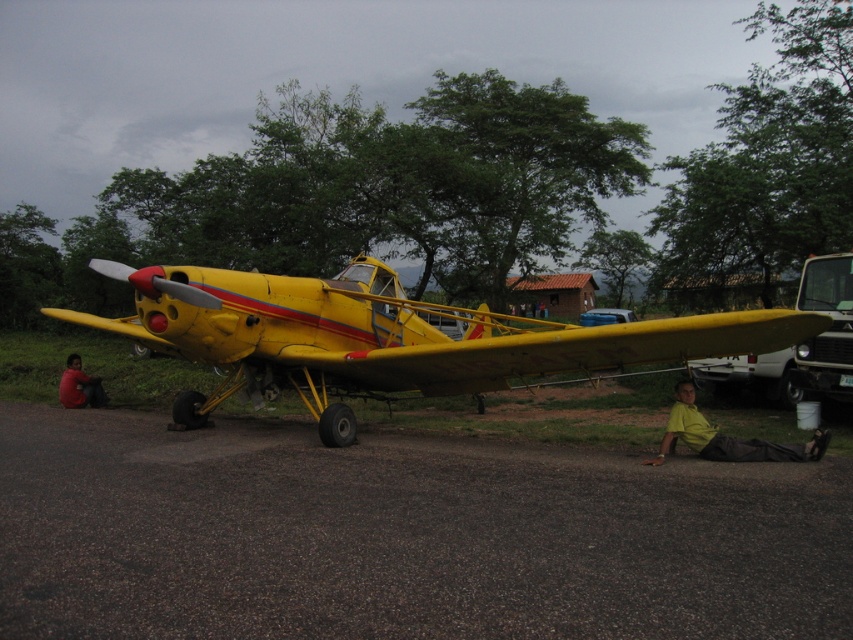
Is point (683, 380) behind point (100, 388)?

Yes, it is.

Does point (819, 433) come in front of point (74, 372)?

Yes, point (819, 433) is closer to viewer.

You are a GUI agent. You are given a task and a screenshot of the screen. Output one action in this format:
    pyautogui.click(x=<x>, y=<y>)
    Task: Click on the yellow cotton shirt at lower right
    Image resolution: width=853 pixels, height=640 pixels.
    Given the screenshot: What is the action you would take?
    pyautogui.click(x=726, y=436)

Is yellow matte airplane at center wider than dark red shirt at lower left?

Correct, the width of yellow matte airplane at center exceeds that of dark red shirt at lower left.

Is yellow matte airplane at center shorter than dark red shirt at lower left?

In fact, yellow matte airplane at center may be taller than dark red shirt at lower left.

Is point (410, 348) closer to camera compared to point (62, 392)?

That is True.

Locate an element on the screen. yellow matte airplane at center is located at coordinates (387, 337).

Is yellow matte airplane at center below yellow cotton shirt at lower right?

Incorrect, yellow matte airplane at center is not positioned below yellow cotton shirt at lower right.

Who is lower down, yellow matte airplane at center or yellow cotton shirt at lower right?

Positioned lower is yellow cotton shirt at lower right.

Between point (412, 312) and point (677, 424), which one is positioned behind?

The point (412, 312) is behind.

The width and height of the screenshot is (853, 640). I want to click on yellow matte airplane at center, so click(387, 337).